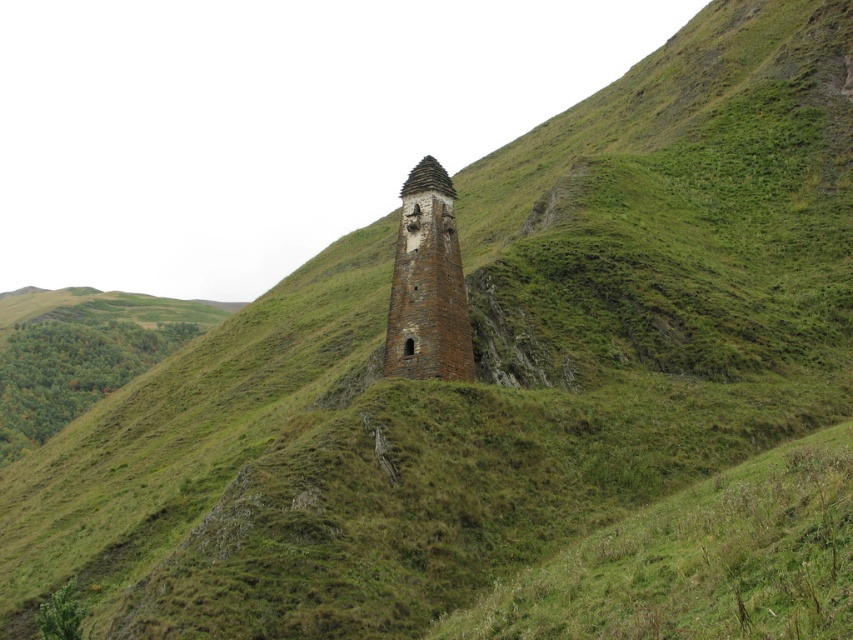
You are a hiker standing at the base of the hill. You see the brown stone tower at center and the brown brick tower at center. Which one is closer to you?

The brown stone tower at center is closer to you because it is positioned under the brown brick tower at center, meaning it is in front of it from your viewpoint.

From the picture: You are standing at the base of the brown stone tower at center and want to reach a hidden treasure located exactly 229.24 feet away from it. If you walk straight ahead from the tower, will you find the treasure in the direction of the grassy hillside or the background?

The treasure is located exactly 229.24 feet away from the brown stone tower at center. Since the distance matches the description, the treasure would be in the direction of the background as the grassy hillside is where the tower is situated.

You are standing at point (427, 284) in the image. What structure is located at your current position?

The brown stone tower at center is located at point (427, 284).